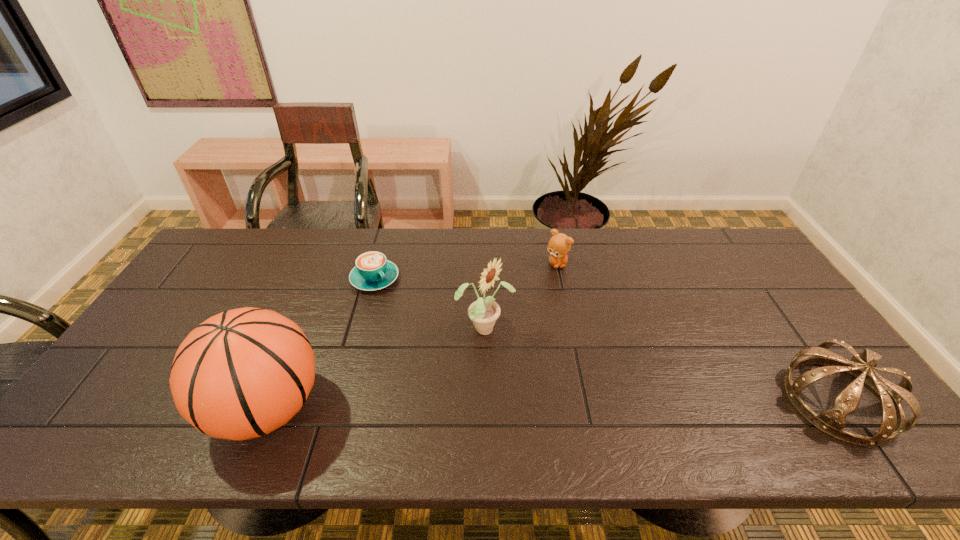
At what (x,y) coordinates should I click in order to perform the action: click on basketball. Please return your answer as a coordinate pair (x, y). Looking at the image, I should click on (243, 373).

You are a GUI agent. You are given a task and a screenshot of the screen. Output one action in this format:
    pyautogui.click(x=<x>, y=<y>)
    Task: Click on the rightmost object
    
    Given the screenshot: What is the action you would take?
    pyautogui.click(x=832, y=421)

The height and width of the screenshot is (540, 960). In order to click on the third shortest object in this screenshot , I will do `click(832, 421)`.

The image size is (960, 540). I want to click on the fourth object from left to right, so click(x=559, y=245).

The width and height of the screenshot is (960, 540). What are the coordinates of `teddy bear` in the screenshot? It's located at (559, 245).

Find the location of `the shortest object`. the shortest object is located at coordinates (373, 271).

This screenshot has height=540, width=960. Find the location of `sunflower`. sunflower is located at coordinates (484, 312).

Where is `the third nearest object`? The height and width of the screenshot is (540, 960). the third nearest object is located at coordinates pyautogui.click(x=484, y=312).

The image size is (960, 540). I want to click on vacant space positioned on the back of the basketball, so click(324, 268).

Where is `vacant space located 0.330m on the left of the rightmost object`? The image size is (960, 540). vacant space located 0.330m on the left of the rightmost object is located at coordinates (648, 401).